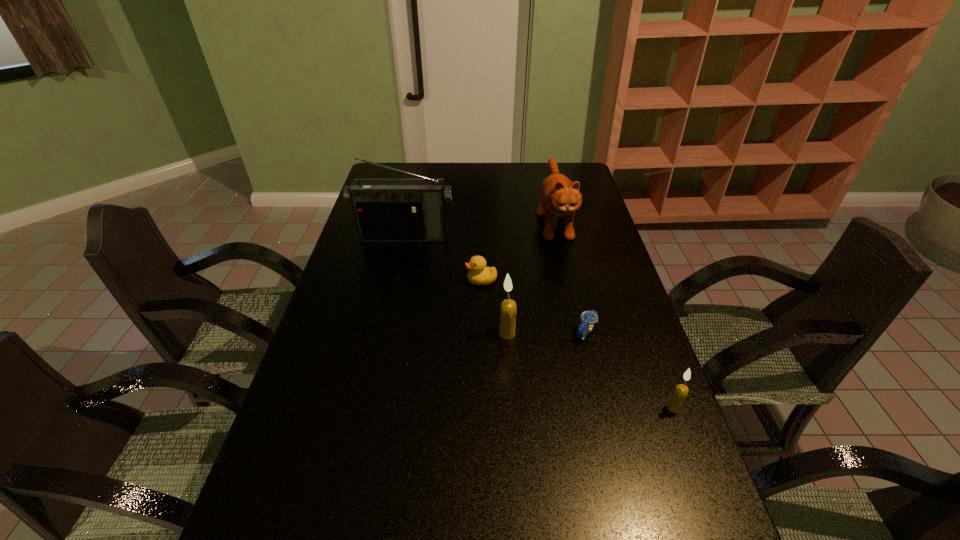
Where is `free space in the image that satisfies the following two spatial constraints: 1. on the face of the cat; 2. on the left side of the watch`? This screenshot has width=960, height=540. free space in the image that satisfies the following two spatial constraints: 1. on the face of the cat; 2. on the left side of the watch is located at coordinates (580, 333).

This screenshot has width=960, height=540. I want to click on vacant position in the image that satisfies the following two spatial constraints: 1. on the front-facing side of the radio receiver; 2. on the right side of the fourth tallest object, so click(367, 408).

This screenshot has height=540, width=960. What are the coordinates of `vacant position in the image that satisfies the following two spatial constraints: 1. on the face of the cat; 2. on the right side of the nearest object` in the screenshot? It's located at (597, 408).

Find the location of a particular element. This screenshot has height=540, width=960. free point that satisfies the following two spatial constraints: 1. on the face of the cat; 2. on the face of the duckling is located at coordinates (568, 280).